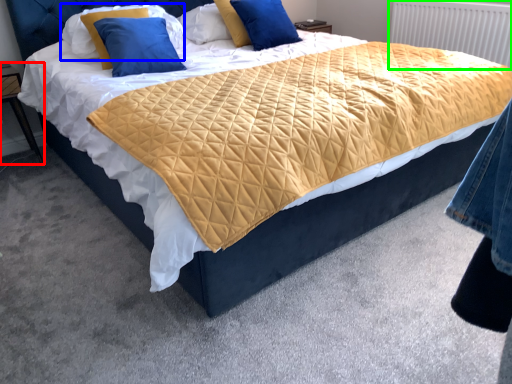
Question: Based on their relative distances, which object is farther from nightstand (highlighted by a red box)? Choose from pillow (highlighted by a blue box) and radiator (highlighted by a green box).

Choices:
 (A) pillow
 (B) radiator

Answer: (B)